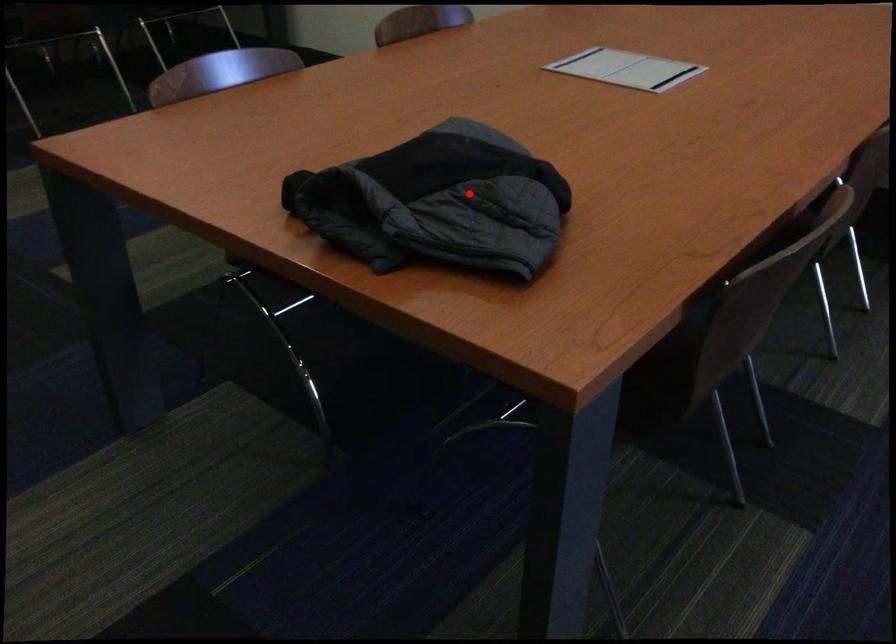
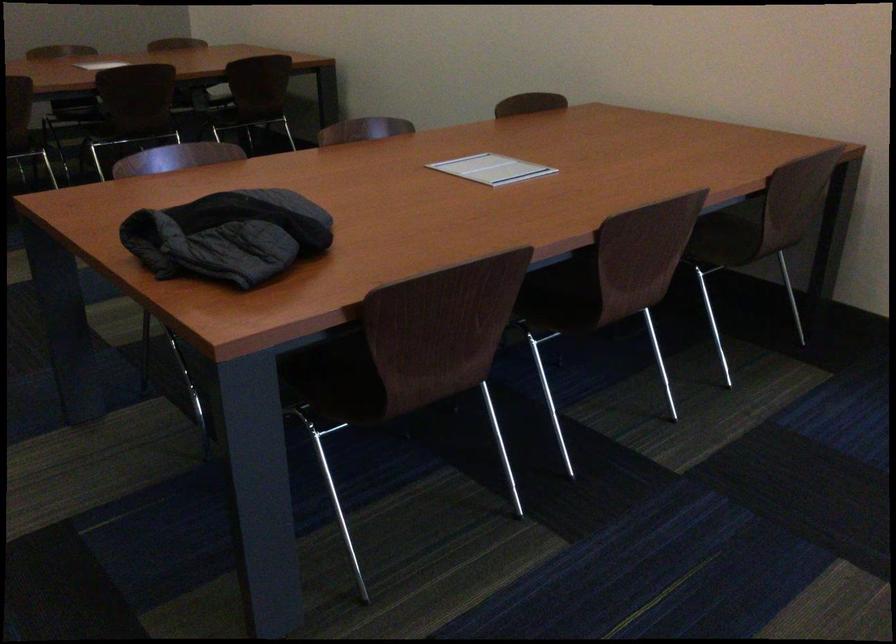
Where in the second image is the point corresponding to the highlighted location from the first image?

(228, 236)